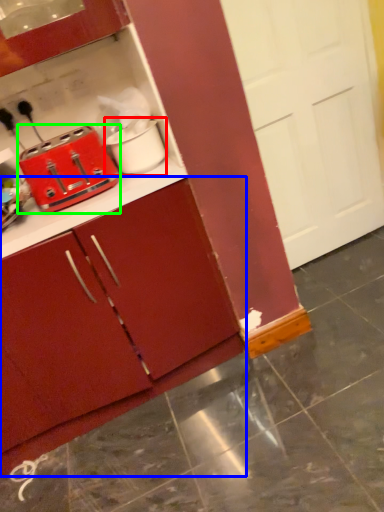
Question: Which object is the farthest from appliance (highlighted by a red box)? Choose among these: cabinetry (highlighted by a blue box) or toaster (highlighted by a green box).

Choices:
 (A) cabinetry
 (B) toaster

Answer: (A)